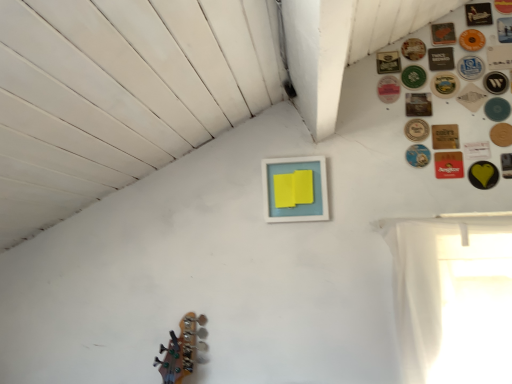
Question: Would you consider wooden coaster at upper right, positioned as the 6th button in bottom-to-top order, to be distant from wooden circular coaster at upper right, the third button positioned from the top?

Choices:
 (A) no
 (B) yes

Answer: (A)

Question: Considering the relative sizes of wooden coaster at upper right, positioned as the 6th button in bottom-to-top order, and wooden circular coaster at upper right, the third button positioned from the top, in the image provided, is wooden coaster at upper right, positioned as the 6th button in bottom-to-top order, taller than wooden circular coaster at upper right, the third button positioned from the top,?

Choices:
 (A) yes
 (B) no

Answer: (B)

Question: From the image's perspective, is wooden coaster at upper right, positioned as the 6th button in bottom-to-top order, on wooden circular coaster at upper right, the third button positioned from the top?

Choices:
 (A) yes
 (B) no

Answer: (B)

Question: Is wooden coaster at upper right, positioned as the 6th button in bottom-to-top order, turned away from wooden circular coaster at upper right, placed as the 23th button when sorted from bottom to top?

Choices:
 (A) yes
 (B) no

Answer: (B)

Question: Is wooden coaster at upper right, acting as the twentieth button starting from the top, shorter than wooden circular coaster at upper right, the third button positioned from the top?

Choices:
 (A) yes
 (B) no

Answer: (A)

Question: Looking at the image, does white paper button at upper right, which is the eleventh button in bottom-to-top order, seem bigger or smaller compared to wooden coaster at upper right, which ranks as the 20th button in bottom-to-top order?

Choices:
 (A) big
 (B) small

Answer: (A)

Question: In the image, is white paper button at upper right, which is the eleventh button in bottom-to-top order, on the left side or the right side of wooden coaster at upper right, which ranks as the 20th button in bottom-to-top order?

Choices:
 (A) left
 (B) right

Answer: (B)

Question: From the image's perspective, is white paper button at upper right, which is the eleventh button in bottom-to-top order, above or below wooden coaster at upper right, which ranks as the 20th button in bottom-to-top order?

Choices:
 (A) below
 (B) above

Answer: (A)

Question: Considering the positions of white paper button at upper right, which is the eleventh button in bottom-to-top order, and wooden coaster at upper right, which ranks as the sixth button in top-to-bottom order, in the image, is white paper button at upper right, which is the eleventh button in bottom-to-top order, wider or thinner than wooden coaster at upper right, which ranks as the sixth button in top-to-bottom order,?

Choices:
 (A) wide
 (B) thin

Answer: (B)

Question: Considering the positions of wooden coaster at upper right, which ranks as the 20th button in bottom-to-top order, and green matte coaster at upper right, the thirteenth button in the bottom-to-top sequence, in the image, is wooden coaster at upper right, which ranks as the 20th button in bottom-to-top order, wider or thinner than green matte coaster at upper right, the thirteenth button in the bottom-to-top sequence,?

Choices:
 (A) wide
 (B) thin

Answer: (B)

Question: From their relative heights in the image, would you say wooden coaster at upper right, which ranks as the sixth button in top-to-bottom order, is taller or shorter than green matte coaster at upper right, acting as the thirteenth button starting from the top?

Choices:
 (A) tall
 (B) short

Answer: (B)

Question: From the image's perspective, is wooden coaster at upper right, which ranks as the 20th button in bottom-to-top order, located above or below green matte coaster at upper right, acting as the thirteenth button starting from the top?

Choices:
 (A) below
 (B) above

Answer: (B)

Question: Is point (409, 38) positioned closer to the camera than point (446, 77)?

Choices:
 (A) closer
 (B) farther

Answer: (B)

Question: Looking at the image, does white sheer curtain at right seem bigger or smaller compared to matte blue picture frame at center?

Choices:
 (A) small
 (B) big

Answer: (B)

Question: From the image's perspective, is white sheer curtain at right above or below matte blue picture frame at center?

Choices:
 (A) below
 (B) above

Answer: (A)